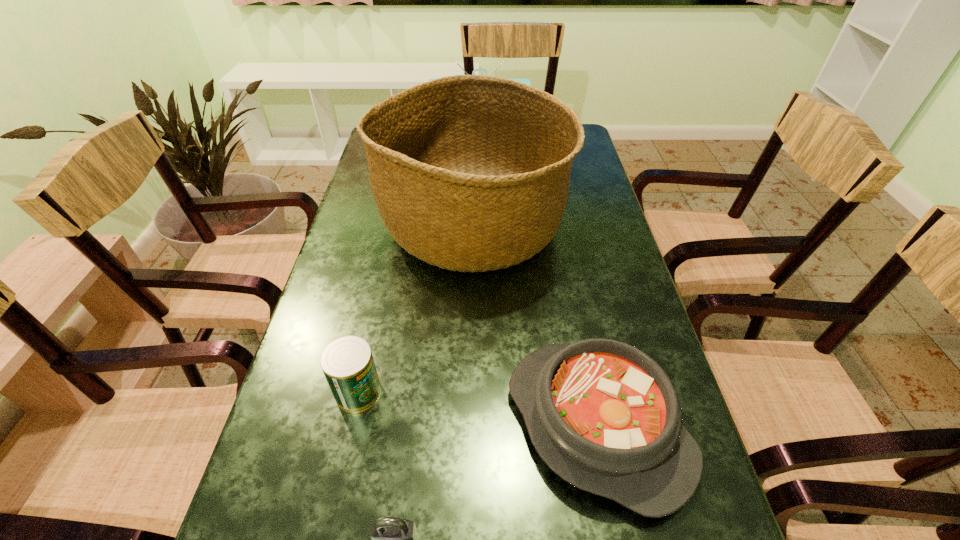
Identify the location of basket. (470, 173).

This screenshot has width=960, height=540. What are the coordinates of `the fourth shortest object` in the screenshot? It's located at (527, 81).

Where is `radio receiver`? Image resolution: width=960 pixels, height=540 pixels. radio receiver is located at coordinates [x=527, y=81].

This screenshot has width=960, height=540. Identify the location of casserole. (604, 416).

In order to click on can in this screenshot , I will do `click(347, 362)`.

This screenshot has height=540, width=960. What are the coordinates of `free space located 0.140m on the right of the basket` in the screenshot? It's located at (614, 226).

Identify the location of vacant position located 0.090m on the front-facing side of the fourth shortest object. (480, 164).

Identify the location of free space located 0.120m on the back of the casserole. [574, 308].

I want to click on vacant space positioned 0.370m on the right of the can, so click(571, 392).

What are the coordinates of `object at the far edge` in the screenshot? It's located at (527, 81).